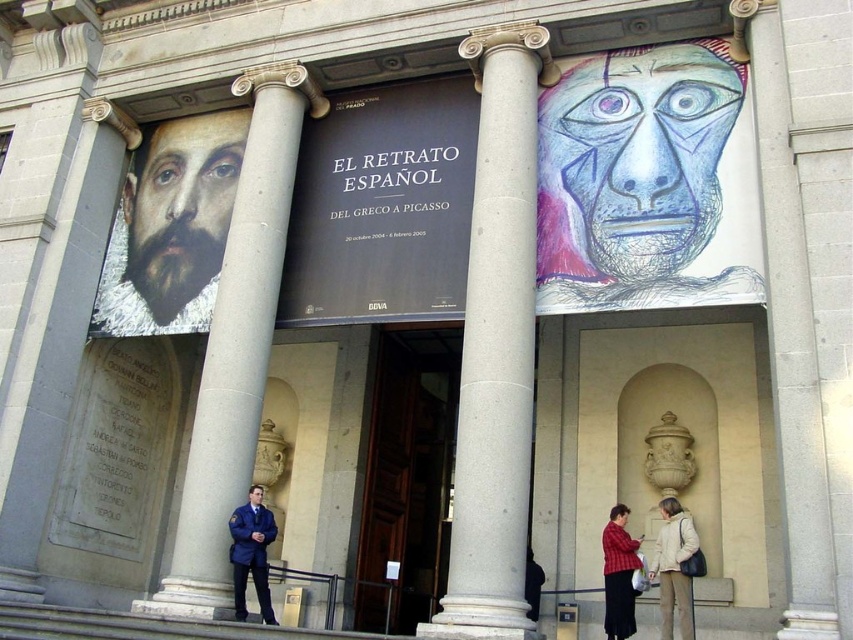
You are an art student observing the entrance of the museum. You notice the blue sketchy face at upper right and the smooth stone column at center. Which object appears taller in the image?

The smooth stone column at center appears taller than the blue sketchy face at upper right.

You are standing at the entrance of the grand building and see the blue uniform at center and the red plaid shirt at lower right. Which object is closer to the ground?

The blue uniform at center is positioned under the red plaid shirt at lower right, so the blue uniform at center is closer to the ground.

You are a visitor standing at the entrance of the building. You notice the gray stone column at center and the blue uniform at center. Which object is taller?

The gray stone column at center is taller than the blue uniform at center.